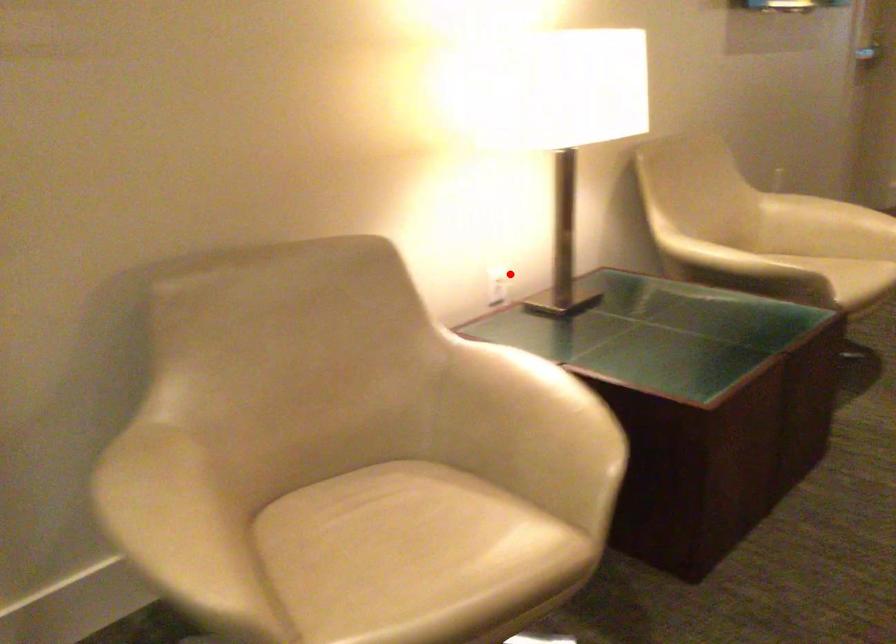
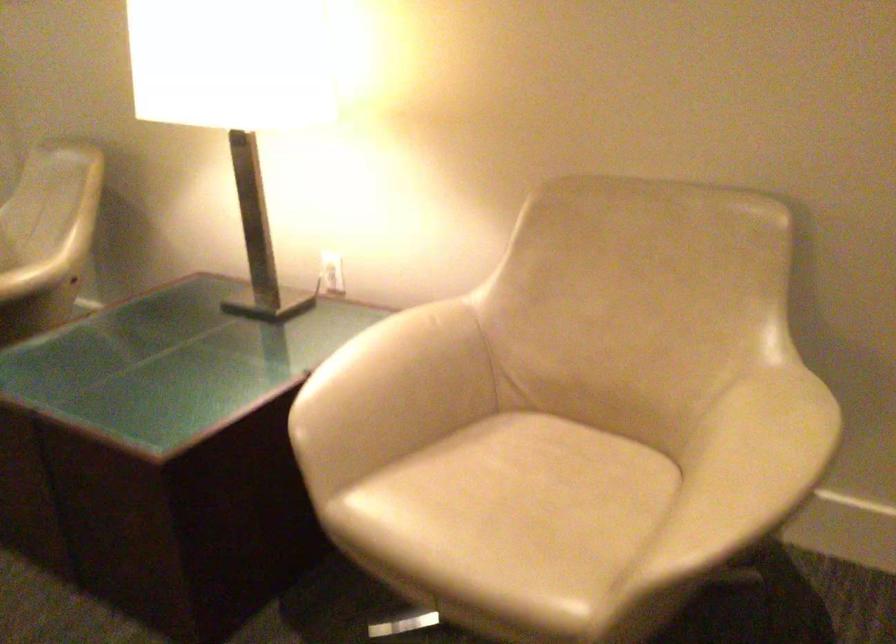
Where in the second image is the point corresponding to the highlighted location from the first image?

(332, 272)